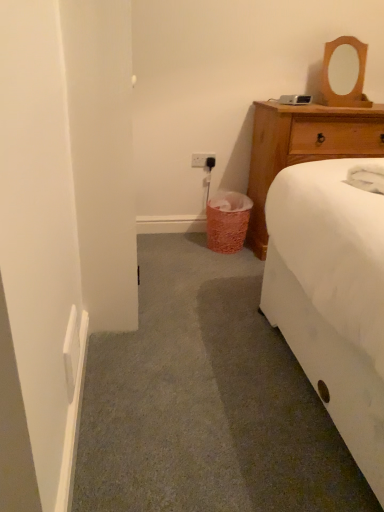
Measure the distance between point (233,194) and camera.

A distance of 8.64 feet exists between point (233,194) and camera.

What is the approximate height of wooden dresser at upper right?

34.46 inches.

Image resolution: width=384 pixels, height=512 pixels. I want to click on wooden mirror at upper right, so [354, 75].

Which object is further away from the camera taking this photo, white plastic power outlet at center or pink textured trash can at lower center?

white plastic power outlet at center is more distant.

Considering the positions of points (208, 160) and (210, 233), is point (208, 160) farther from camera compared to point (210, 233)?

Yes.

Which object is positioned more to the right, white plastic power outlet at center or pink textured trash can at lower center?

pink textured trash can at lower center.

Which is more to the left, wooden mirror at upper right or wooden dresser at upper right?

From the viewer's perspective, wooden dresser at upper right appears more on the left side.

Can you see wooden mirror at upper right touching wooden dresser at upper right?

There is a gap between wooden mirror at upper right and wooden dresser at upper right.

In the scene shown: Is wooden mirror at upper right outside of wooden dresser at upper right?

wooden mirror at upper right is positioned outside wooden dresser at upper right.

Where is `mirror on the right of the wooden dresser at upper right`? mirror on the right of the wooden dresser at upper right is located at coordinates (354, 75).

Would you say pink textured trash can at lower center is outside wooden dresser at upper right?

Yes, pink textured trash can at lower center is located beyond the bounds of wooden dresser at upper right.

Consider the image. Considering the sizes of objects pink textured trash can at lower center and wooden dresser at upper right in the image provided, who is thinner, pink textured trash can at lower center or wooden dresser at upper right?

pink textured trash can at lower center.

From the picture: Is there a large distance between pink textured trash can at lower center and wooden dresser at upper right?

No, pink textured trash can at lower center is in close proximity to wooden dresser at upper right.

You are a GUI agent. You are given a task and a screenshot of the screen. Output one action in this format:
    pyautogui.click(x=<x>, y=<y>)
    Task: Click on the chest of drawers above the pink textured trash can at lower center (from the image's perspective)
    The width and height of the screenshot is (384, 512).
    Given the screenshot: What is the action you would take?
    pyautogui.click(x=304, y=147)

Which is in front, wooden dresser at upper right or wooden mirror at upper right?

wooden dresser at upper right is closer to the camera.

Is wooden dresser at upper right next to wooden mirror at upper right?

No, wooden dresser at upper right is not beside wooden mirror at upper right.

Which of these two, wooden dresser at upper right or wooden mirror at upper right, stands shorter?

With less height is wooden mirror at upper right.

Looking at this image, from a real-world perspective, is wooden dresser at upper right above or below wooden mirror at upper right?

wooden dresser at upper right is below wooden mirror at upper right.

Between wooden dresser at upper right and white plastic power outlet at center, which one has less height?

white plastic power outlet at center is shorter.

Is point (260, 248) positioned before point (204, 165)?

Yes, it is.

From a real-world perspective, is wooden dresser at upper right physically above white plastic power outlet at center?

Incorrect, from a real-world perspective, wooden dresser at upper right is lower than white plastic power outlet at center.

Is white plastic power outlet at center at the back of wooden dresser at upper right?

That's not correct — wooden dresser at upper right is not looking away from white plastic power outlet at center.

From the picture: Is wooden dresser at upper right spatially inside pink textured trash can at lower center, or outside of it?

wooden dresser at upper right exists outside the volume of pink textured trash can at lower center.

Is wooden dresser at upper right taller than pink textured trash can at lower center?

Yes, wooden dresser at upper right is taller than pink textured trash can at lower center.

Would you say wooden dresser at upper right is a long distance from pink textured trash can at lower center?

No, wooden dresser at upper right is in close proximity to pink textured trash can at lower center.

Which point is more forward, (371, 153) or (220, 218)?

The point (371, 153) is more forward.

Which of these two, wooden mirror at upper right or pink textured trash can at lower center, stands taller?

With more height is wooden mirror at upper right.

Can you confirm if wooden mirror at upper right is wider than pink textured trash can at lower center?

Incorrect, the width of wooden mirror at upper right does not surpass that of pink textured trash can at lower center.

Based on the photo, which is farther, (344,80) or (228,233)?

The point (344,80) is more distant.

Is wooden mirror at upper right looking in the opposite direction of pink textured trash can at lower center?

No, wooden mirror at upper right is not facing the opposite direction of pink textured trash can at lower center.

Identify the location of power outlet that is behind the pink textured trash can at lower center. Image resolution: width=384 pixels, height=512 pixels. (203, 161).

In the image, there is a wooden mirror at upper right. Identify the location of the chest of drawers below it (from the image's perspective). (304, 147).

From the image, which object appears to be nearer to pink textured trash can at lower center, white plastic power outlet at center or wooden mirror at upper right?

Based on the image, white plastic power outlet at center appears to be nearer to pink textured trash can at lower center.

Based on their spatial positions, is wooden dresser at upper right or pink textured trash can at lower center further from white plastic power outlet at center?

wooden dresser at upper right lies further to white plastic power outlet at center than the other object.

When comparing their distances from wooden dresser at upper right, does pink textured trash can at lower center or wooden mirror at upper right seem further?

Based on the image, pink textured trash can at lower center appears to be further to wooden dresser at upper right.

When comparing their distances from wooden dresser at upper right, does pink textured trash can at lower center or white plastic power outlet at center seem closer?

Based on the image, pink textured trash can at lower center appears to be nearer to wooden dresser at upper right.

From the image, which object appears to be farther from white plastic power outlet at center, wooden mirror at upper right or pink textured trash can at lower center?

The object further to white plastic power outlet at center is wooden mirror at upper right.

When comparing their distances from wooden mirror at upper right, does pink textured trash can at lower center or wooden dresser at upper right seem closer?

wooden dresser at upper right.

From the image, which object appears to be nearer to pink textured trash can at lower center, white plastic power outlet at center or wooden dresser at upper right?

Among the two, wooden dresser at upper right is located nearer to pink textured trash can at lower center.

Looking at the image, which one is located closer to wooden dresser at upper right, white plastic power outlet at center or pink textured trash can at lower center?

pink textured trash can at lower center.

Find the location of a particular element. The width and height of the screenshot is (384, 512). the chest of drawers situated between white plastic power outlet at center and wooden mirror at upper right from left to right is located at coordinates (304, 147).

Locate an element on the screen. The image size is (384, 512). trash bin/can between white plastic power outlet at center and wooden mirror at upper right is located at coordinates (227, 221).

Locate an element on the screen. The image size is (384, 512). trash bin/can between white plastic power outlet at center and wooden dresser at upper right in the horizontal direction is located at coordinates (227, 221).

Identify the location of chest of drawers between wooden mirror at upper right and pink textured trash can at lower center in the vertical direction. (304, 147).